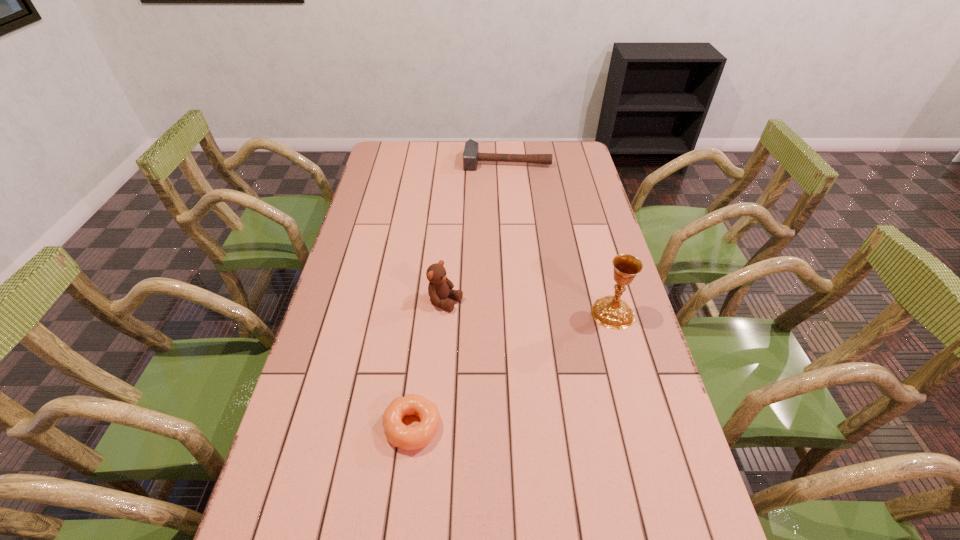
At what (x,y) coordinates should I click in order to perform the action: click on free space between the doughnut and the third shortest object. Please return your answer as a coordinate pair (x, y). The image size is (960, 540). Looking at the image, I should click on (429, 364).

You are a GUI agent. You are given a task and a screenshot of the screen. Output one action in this format:
    pyautogui.click(x=<x>, y=<y>)
    Task: Click on the unoccupied area between the farthest object and the rightmost object
    This screenshot has height=540, width=960.
    Given the screenshot: What is the action you would take?
    pyautogui.click(x=560, y=237)

Identify the location of empty space between the tallest object and the nearest object. Image resolution: width=960 pixels, height=540 pixels. (513, 369).

The image size is (960, 540). I want to click on the third closest object to the chalice, so click(471, 156).

Locate an element on the screen. object that can be found as the second closest to the hammer is located at coordinates (611, 312).

At what (x,y) coordinates should I click in order to perform the action: click on blank area in the image that satisfies the following two spatial constraints: 1. on the back side of the teddy bear; 2. on the left side of the farthest object. Please return your answer as a coordinate pair (x, y). Image resolution: width=960 pixels, height=540 pixels. Looking at the image, I should click on (456, 161).